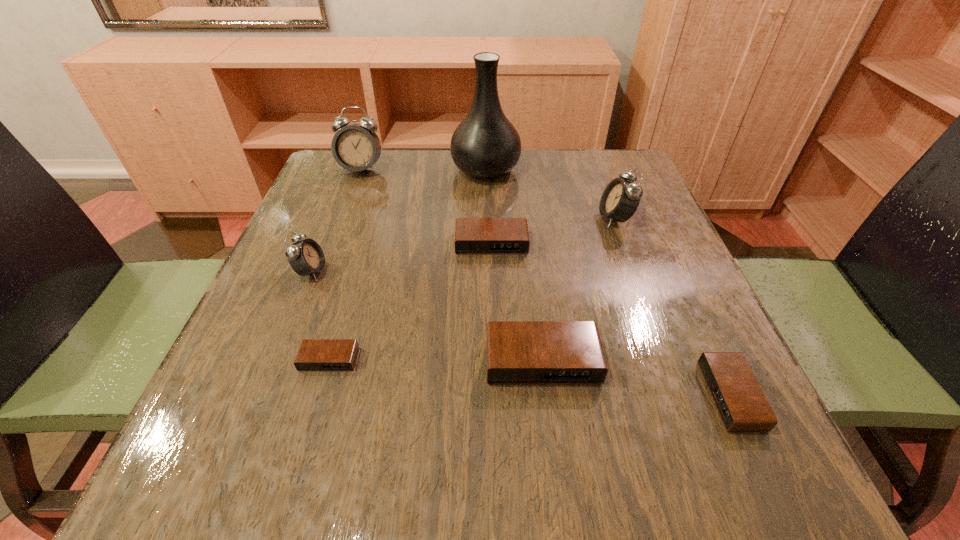
You are a GUI agent. You are given a task and a screenshot of the screen. Output one action in this format:
    pyautogui.click(x=<x>, y=<y>)
    Task: Click on the object that is at the far left corner
    Image resolution: width=960 pixels, height=540 pixels.
    Given the screenshot: What is the action you would take?
    pyautogui.click(x=356, y=147)

You are a GUI agent. You are given a task and a screenshot of the screen. Output one action in this format:
    pyautogui.click(x=<x>, y=<y>)
    Task: Click on the object that is at the near right corner
    The image size is (960, 540).
    Given the screenshot: What is the action you would take?
    pyautogui.click(x=742, y=406)

I want to click on vacant space at the far edge, so click(x=409, y=195).

At what (x,y) coordinates should I click in order to perform the action: click on vacant space at the near edge of the desktop. Please return your answer as a coordinate pair (x, y). This screenshot has height=540, width=960. Looking at the image, I should click on (454, 500).

Locate an element on the screen. The width and height of the screenshot is (960, 540). free region at the left edge of the desktop is located at coordinates (217, 388).

Identify the location of free region at the right edge of the desktop. This screenshot has height=540, width=960. (680, 322).

Locate an element on the screen. This screenshot has width=960, height=540. vacant area at the near left corner is located at coordinates click(x=190, y=483).

Identify the location of free space at the far right corner. The width and height of the screenshot is (960, 540). (579, 173).

Locate an element on the screen. This screenshot has width=960, height=540. vacant space that is in between the rightmost white alarm clock and the fourth shortest object is located at coordinates (579, 289).

You are a GUI agent. You are given a task and a screenshot of the screen. Output one action in this format:
    pyautogui.click(x=<x>, y=<y>)
    Task: Click on the free space between the shortest alarm clock and the farthest black alarm clock
    
    Given the screenshot: What is the action you would take?
    pyautogui.click(x=410, y=301)